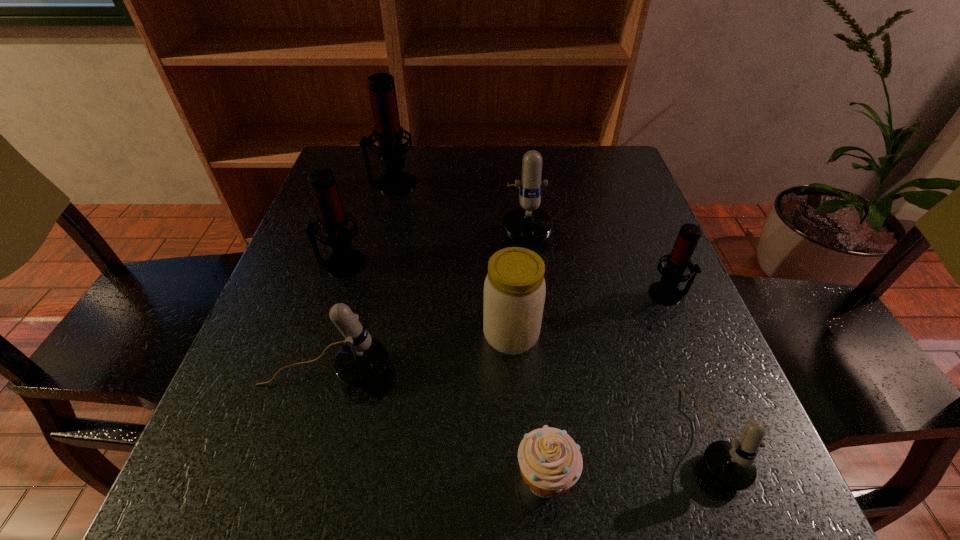
Locate an element on the screen. This screenshot has width=960, height=540. microphone that is at the near edge is located at coordinates (731, 464).

Where is `muffin present at the near edge`? muffin present at the near edge is located at coordinates (550, 462).

Find the location of a particular element. object that is at the far left corner is located at coordinates (388, 132).

Where is `object that is at the near right corner`? object that is at the near right corner is located at coordinates (731, 464).

Identify the location of vacant area at the far edge. The image size is (960, 540). (483, 184).

This screenshot has width=960, height=540. Identify the location of free point at the near edge. (521, 474).

Identify the location of vacant space at the left edge of the desktop. This screenshot has height=540, width=960. (287, 291).

The height and width of the screenshot is (540, 960). Find the location of `vacant space at the right edge of the desktop`. vacant space at the right edge of the desktop is located at coordinates (614, 235).

Locate an element on the screen. free space at the far left corner of the desktop is located at coordinates (380, 169).

This screenshot has width=960, height=540. Identify the location of blank space at the far right corner of the desktop. [x=586, y=173].